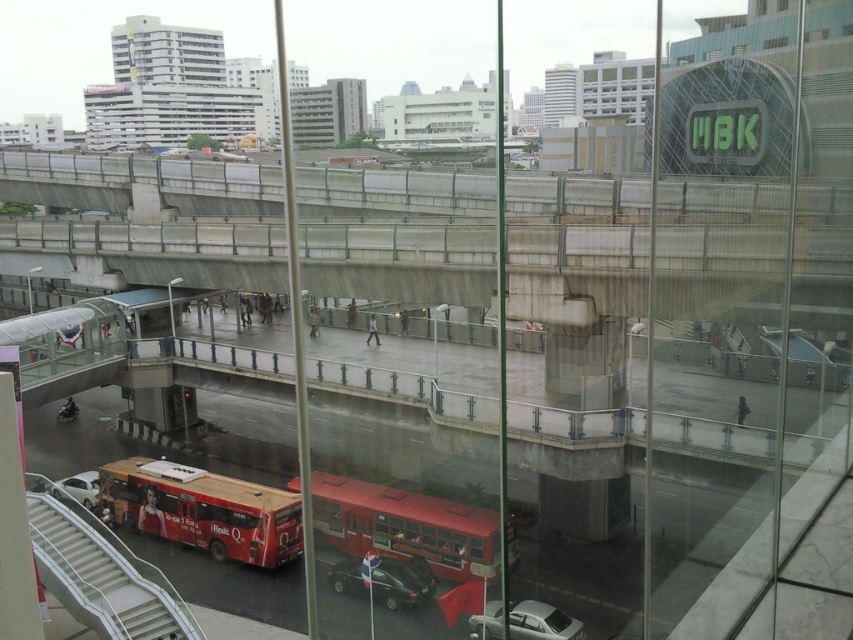
You are standing on the wet walkway and see a point marked at coordinates (x=202, y=509). What object does this point correspond to in the scene?

The point corresponds to the red matte bus at lower left.

You are standing at the point with coordinates point (459, 570) on the walkway and want to move to the point with coordinates point (224, 493). Given that the walkway is wet, will your path be obstructed by any objects between these two points?

The point (224, 493) is behind point (459, 570), so moving from point (459, 570) to point (224, 493) would mean moving towards a position that is further away from the viewer. Since the walkway is wet but there are no objects mentioned between them, your path is not obstructed.

You are a delivery person trying to carry a large box through the white plastic escalator at lower left. The box is as wide as the shiny red bus at center. Will the box fit through the escalator?

The white plastic escalator at lower left is wider than the shiny red bus at center, so the box, which is as wide as the bus, will fit through the escalator since the escalator is wider.